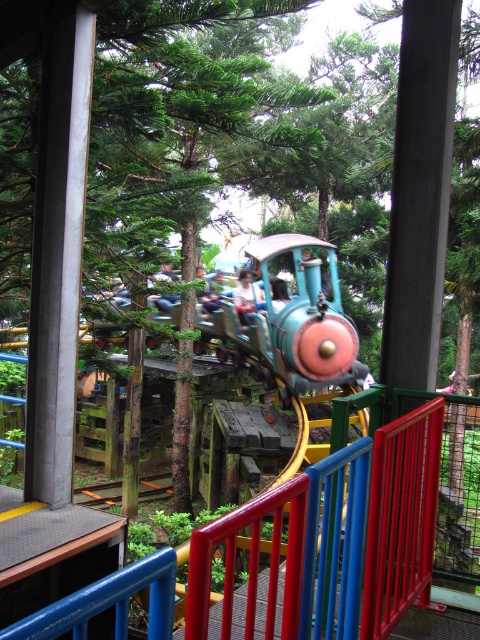
Does shiny blue train at center appear under light blue fabric shirt at center?

Correct, shiny blue train at center is located below light blue fabric shirt at center.

Which is more to the left, shiny blue train at center or light blue fabric shirt at center?

From the viewer's perspective, light blue fabric shirt at center appears more on the left side.

Identify the location of shiny blue train at center. Image resolution: width=480 pixels, height=640 pixels. (289, 323).

The width and height of the screenshot is (480, 640). I want to click on shiny blue train at center, so click(289, 323).